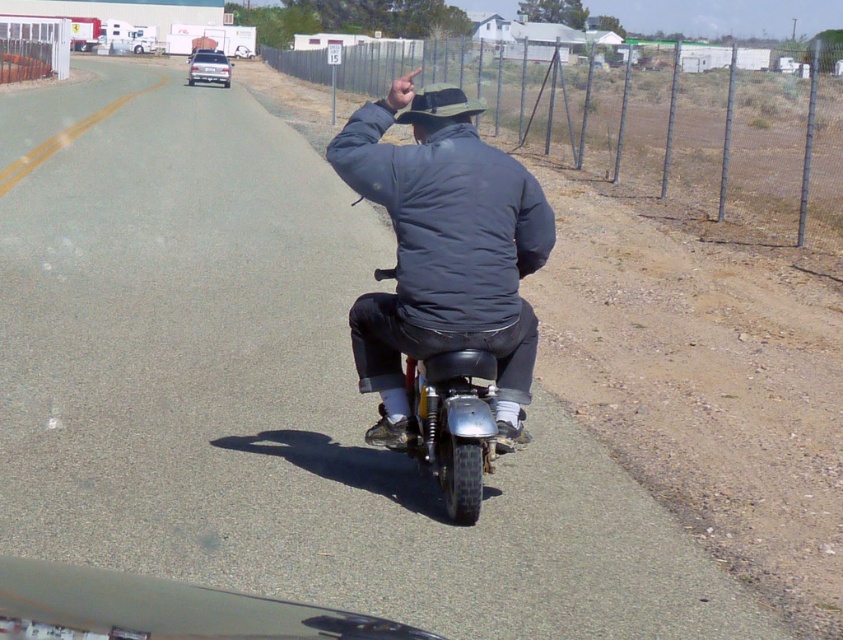
You are a pedestrian standing on the road and want to cross to the other side. The matte black motorcycle at center is blocking your path. Can you walk around it by moving towards the dark gray puffy jacket at center?

The dark gray puffy jacket at center is behind the matte black motorcycle at center, so you cannot walk around the motorcycle by moving towards the dark gray puffy jacket at center since it is located behind the motorcycle.

You are a delivery driver who needs to choose between the matte black motorcycle at center and the shiny chrome motorcycle at center for a delivery job. The job requires the motorcycle to be able to carry a large package that needs extra height clearance. Which motorcycle should you choose?

The shiny chrome motorcycle at center is taller than the matte black motorcycle at center, so you should choose the shiny chrome motorcycle at center to ensure there is enough height clearance for the large package.

You are a pedestrian standing on the road and want to know which object is taller between the dark gray puffy jacket at center and the shiny chrome motorcycle at center. Can you tell me?

The dark gray puffy jacket at center has a lesser height compared to the shiny chrome motorcycle at center, so the shiny chrome motorcycle at center is taller.